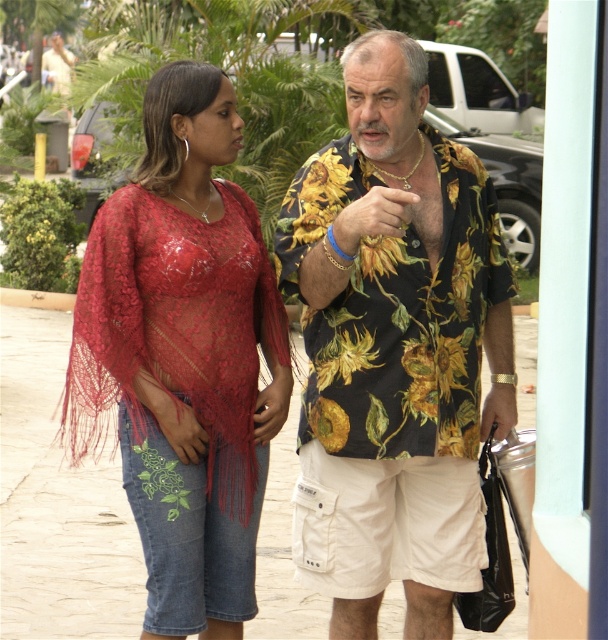
You are a GUI agent. You are given a task and a screenshot of the screen. Output one action in this format:
    pyautogui.click(x=<x>, y=<y>)
    Task: Click on the denim shorts at lower left
    
    Given the screenshot: What is the action you would take?
    pyautogui.click(x=187, y=534)

Is denim shorts at lower left to the right of gold metallic bracelet at upper center from the viewer's perspective?

In fact, denim shorts at lower left is to the left of gold metallic bracelet at upper center.

Does point (254, 560) lie behind point (398, 209)?

Yes.

The height and width of the screenshot is (640, 608). In order to click on denim shorts at lower left in this screenshot , I will do `click(187, 534)`.

Looking at this image, which is below, floral-patterned shirt at center or lace fabric top at left?

lace fabric top at left is lower down.

Does floral-patterned shirt at center have a greater width compared to lace fabric top at left?

Correct, the width of floral-patterned shirt at center exceeds that of lace fabric top at left.

Is point (477, 483) in front of point (219, 182)?

Yes, it is.

The width and height of the screenshot is (608, 640). Find the location of `floral-patterned shirt at center`. floral-patterned shirt at center is located at coordinates (395, 355).

Where is `smooth concrete pavement at center`? The width and height of the screenshot is (608, 640). smooth concrete pavement at center is located at coordinates (57, 502).

Where is `smooth concrete pavement at center`? The height and width of the screenshot is (640, 608). smooth concrete pavement at center is located at coordinates (57, 502).

Find the location of `smooth concrete pavement at center`. smooth concrete pavement at center is located at coordinates (57, 502).